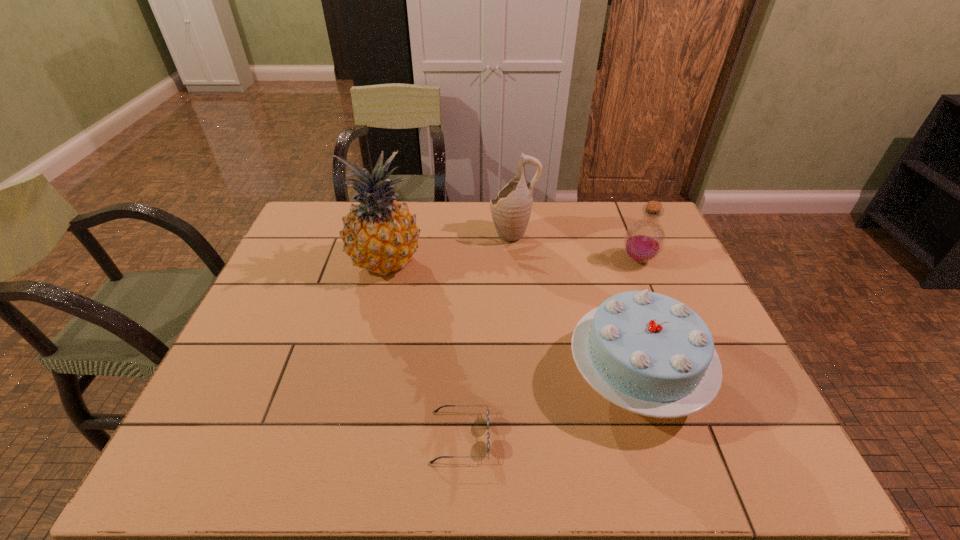
What are the coordinates of `birthday cake present at the right edge` in the screenshot? It's located at tap(648, 353).

This screenshot has height=540, width=960. What are the coordinates of `object that is at the near right corner` in the screenshot? It's located at (648, 353).

This screenshot has width=960, height=540. What are the coordinates of `vacant space at the far edge of the desktop` in the screenshot? It's located at (581, 240).

Where is `vacant area at the near edge`? vacant area at the near edge is located at coordinates (298, 451).

Identify the location of vacant space at the left edge of the desktop. The height and width of the screenshot is (540, 960). (293, 300).

The image size is (960, 540). In order to click on vacant region at the right edge of the desktop in this screenshot , I will do `click(670, 256)`.

Locate an element on the screen. free point at the far left corner is located at coordinates pos(335,235).

This screenshot has width=960, height=540. In order to click on vacant area that lies between the leftmost object and the second object from left to right in this screenshot , I will do `click(422, 349)`.

Where is `vacant area that lies between the leftmost object and the fourth shortest object`? The height and width of the screenshot is (540, 960). vacant area that lies between the leftmost object and the fourth shortest object is located at coordinates (449, 248).

Identify the location of free space that is in between the sunglasses and the pitcher. (487, 335).